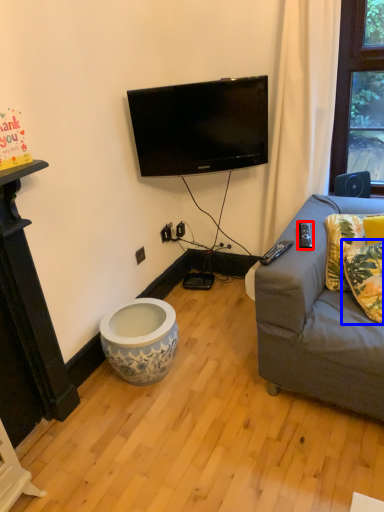
Question: Which object is closer to the camera taking this photo, remote control (highlighted by a red box) or pillow (highlighted by a blue box)?

Choices:
 (A) remote control
 (B) pillow

Answer: (B)